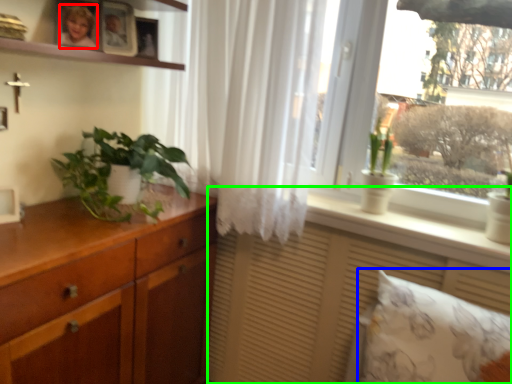
Question: Considering the real-world distances, which object is closest to person (highlighted by a red box)? pillow (highlighted by a blue box) or vanity (highlighted by a green box).

Choices:
 (A) pillow
 (B) vanity

Answer: (B)